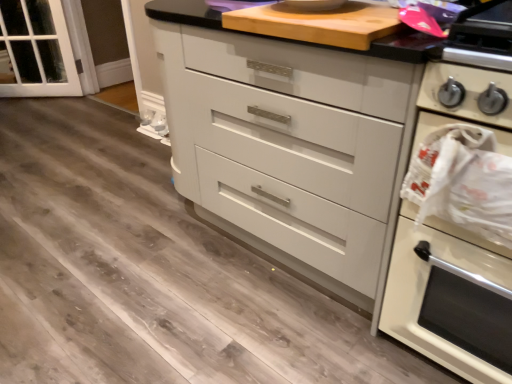
Where is `clear glass door at left`? This screenshot has width=512, height=384. clear glass door at left is located at coordinates (36, 50).

Describe the element at coordinates (289, 146) in the screenshot. This screenshot has width=512, height=384. I see `white glossy chest of drawers at center` at that location.

In order to click on clear glass door at left in this screenshot , I will do `click(36, 50)`.

Considering the sizes of objects clear glass door at left and white glossy oven at right in the image provided, who is wider, clear glass door at left or white glossy oven at right?

white glossy oven at right.

Is point (9, 10) positioned before point (500, 286)?

That is False.

Is clear glass door at left facing towards white glossy oven at right?

No, clear glass door at left is not facing towards white glossy oven at right.

Can you see clear glass door at left touching white glossy oven at right?

There is a gap between clear glass door at left and white glossy oven at right.

From a real-world perspective, does clear glass door at left sit lower than wooden cutting board at upper center?

Yes, from a real-world perspective, clear glass door at left is under wooden cutting board at upper center.

Between clear glass door at left and wooden cutting board at upper center, which one is positioned behind?

clear glass door at left is further away from the camera.

In terms of width, does wooden cutting board at upper center look wider or thinner when compared to white glossy chest of drawers at center?

Considering their sizes, wooden cutting board at upper center looks slimmer than white glossy chest of drawers at center.

Is wooden cutting board at upper center in contact with white glossy chest of drawers at center?

No, wooden cutting board at upper center is not beside white glossy chest of drawers at center.

The width and height of the screenshot is (512, 384). What are the coordinates of `the chest of drawers lying in front of the wooden cutting board at upper center` in the screenshot? It's located at (289, 146).

Considering the relative sizes of wooden cutting board at upper center and clear glass door at left in the image provided, is wooden cutting board at upper center shorter than clear glass door at left?

Yes.

Who is smaller, wooden cutting board at upper center or clear glass door at left?

With smaller size is wooden cutting board at upper center.

Between point (382, 23) and point (31, 10), which one is positioned in front?

Point (382, 23)

Are wooden cutting board at upper center and clear glass door at left making contact?

No, wooden cutting board at upper center is not making contact with clear glass door at left.

Is white glossy oven at right located within white glossy chest of drawers at center?

Definitely not — white glossy oven at right is not inside white glossy chest of drawers at center.

Are white glossy chest of drawers at center and white glossy oven at right located far from each other?

No, there isn't a large distance between white glossy chest of drawers at center and white glossy oven at right.

From the image's perspective, relative to white glossy oven at right, is white glossy chest of drawers at center above or below?

white glossy chest of drawers at center is situated higher than white glossy oven at right in the image.

Between white glossy chest of drawers at center and clear glass door at left, which one has smaller size?

With smaller size is clear glass door at left.

Is the depth of white glossy chest of drawers at center greater than that of clear glass door at left?

No, the depth of white glossy chest of drawers at center is less than that of clear glass door at left.

Is white glossy chest of drawers at center next to clear glass door at left and touching it?

No, white glossy chest of drawers at center is not making contact with clear glass door at left.

In terms of width, does white glossy chest of drawers at center look wider or thinner when compared to clear glass door at left?

white glossy chest of drawers at center is wider than clear glass door at left.

Who is smaller, clear glass door at left or white glossy chest of drawers at center?

clear glass door at left is smaller.

From the image's perspective, relative to white glossy chest of drawers at center, is clear glass door at left above or below?

From the image's perspective, clear glass door at left appears above white glossy chest of drawers at center.

Considering the sizes of objects clear glass door at left and white glossy chest of drawers at center in the image provided, who is thinner, clear glass door at left or white glossy chest of drawers at center?

clear glass door at left.

Are clear glass door at left and white glossy chest of drawers at center far apart?

Yes, clear glass door at left and white glossy chest of drawers at center are located far from each other.

The image size is (512, 384). What are the coordinates of `home appliance located on the right of clear glass door at left` in the screenshot? It's located at (450, 297).

Where is `appliance below the clear glass door at left (from the image's perspective)`? This screenshot has height=384, width=512. appliance below the clear glass door at left (from the image's perspective) is located at coordinates (318, 23).

Which object lies further to the anchor point white glossy chest of drawers at center, clear glass door at left or wooden cutting board at upper center?

clear glass door at left is further to white glossy chest of drawers at center.

Which object lies further to the anchor point white glossy oven at right, wooden cutting board at upper center or clear glass door at left?

The object further to white glossy oven at right is clear glass door at left.

Considering their positions, is wooden cutting board at upper center positioned closer to white glossy chest of drawers at center than white glossy oven at right?

Among the two, wooden cutting board at upper center is located nearer to white glossy chest of drawers at center.

Consider the image. Looking at the image, which one is located closer to white glossy oven at right, white glossy chest of drawers at center or wooden cutting board at upper center?

The object closer to white glossy oven at right is white glossy chest of drawers at center.

In the scene shown: Looking at the image, which one is located further to clear glass door at left, white glossy chest of drawers at center or wooden cutting board at upper center?

wooden cutting board at upper center.

Which object lies nearer to the anchor point wooden cutting board at upper center, white glossy oven at right or white glossy chest of drawers at center?

white glossy chest of drawers at center is closer to wooden cutting board at upper center.

Based on their spatial positions, is clear glass door at left or white glossy chest of drawers at center closer to wooden cutting board at upper center?

white glossy chest of drawers at center is closer to wooden cutting board at upper center.

When comparing their distances from clear glass door at left, does wooden cutting board at upper center or white glossy chest of drawers at center seem further?

wooden cutting board at upper center.

This screenshot has width=512, height=384. I want to click on chest of drawers between white glossy oven at right and clear glass door at left in the front-back direction, so click(289, 146).

The height and width of the screenshot is (384, 512). I want to click on chest of drawers between wooden cutting board at upper center and white glossy oven at right in the vertical direction, so click(289, 146).

Locate an element on the screen. The image size is (512, 384). appliance between white glossy chest of drawers at center and clear glass door at left in the front-back direction is located at coordinates (318, 23).

You are a GUI agent. You are given a task and a screenshot of the screen. Output one action in this format:
    pyautogui.click(x=<x>, y=<y>)
    Task: Click on the appliance situated between clear glass door at left and white glossy oven at right from left to right
    This screenshot has height=384, width=512.
    Given the screenshot: What is the action you would take?
    pyautogui.click(x=318, y=23)